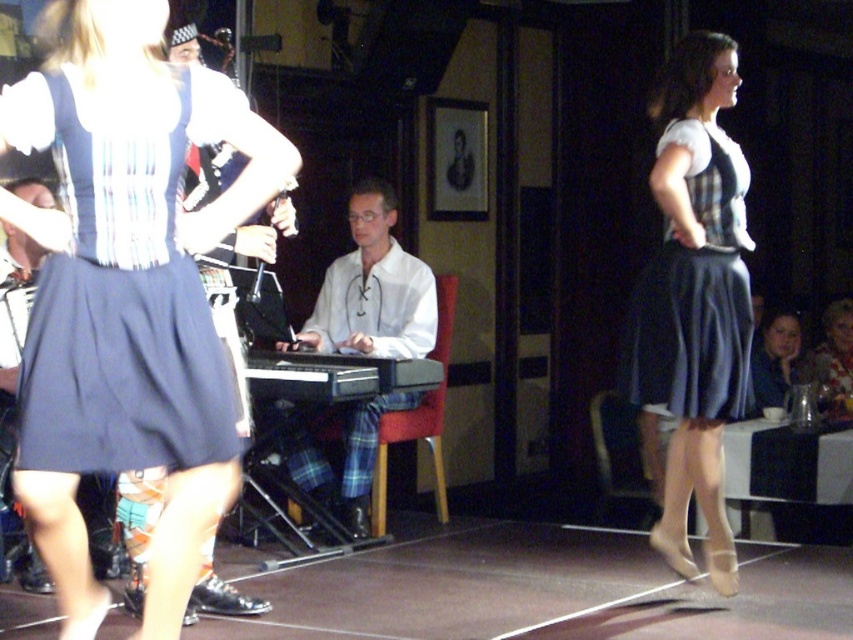
In order to click on matte blue skirt at left in this screenshot , I will do `click(123, 304)`.

Does point (70, 369) come farther from viewer compared to point (838, 358)?

That is False.

This screenshot has width=853, height=640. I want to click on matte blue skirt at left, so click(x=123, y=304).

Is matte black dress at right thinner than matte black hair at upper right?

Correct, matte black dress at right's width is less than matte black hair at upper right's.

Image resolution: width=853 pixels, height=640 pixels. In order to click on matte black dress at right in this screenshot , I will do `click(695, 294)`.

Identify the location of matte black dress at right. (695, 294).

Looking at this image, can you confirm if matte blue skirt at left is taller than matte black dress at right?

Incorrect, matte blue skirt at left's height is not larger of matte black dress at right's.

You are a GUI agent. You are given a task and a screenshot of the screen. Output one action in this format:
    pyautogui.click(x=<x>, y=<y>)
    Task: Click on the matte blue skirt at left
    
    Given the screenshot: What is the action you would take?
    pyautogui.click(x=123, y=304)

I want to click on matte blue skirt at left, so click(123, 304).